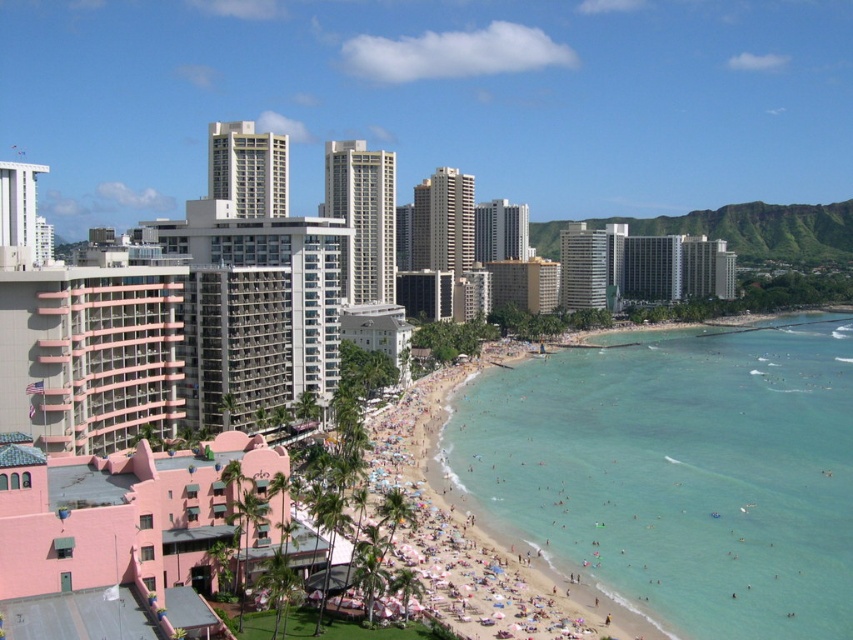
Question: Does clear blue water at beach right appear over gray concrete building at center?

Choices:
 (A) yes
 (B) no

Answer: (B)

Question: Which object appears closest to the camera in this image?

Choices:
 (A) clear blue water at beach right
 (B) beach sand at center
 (C) pink concrete building at center
 (D) gray concrete building at center

Answer: (B)

Question: Does clear blue water at beach right have a larger size compared to gray concrete building at center?

Choices:
 (A) yes
 (B) no

Answer: (A)

Question: Is pink concrete building at center thinner than beach sand at center?

Choices:
 (A) no
 (B) yes

Answer: (A)

Question: Estimate the real-world distances between objects in this image. Which object is closer to the beach sand at center?

Choices:
 (A) pink concrete building at center
 (B) gray concrete building at center

Answer: (B)

Question: Which object is farther from the camera taking this photo?

Choices:
 (A) clear blue water at beach right
 (B) pink concrete building at center
 (C) beach sand at center

Answer: (B)